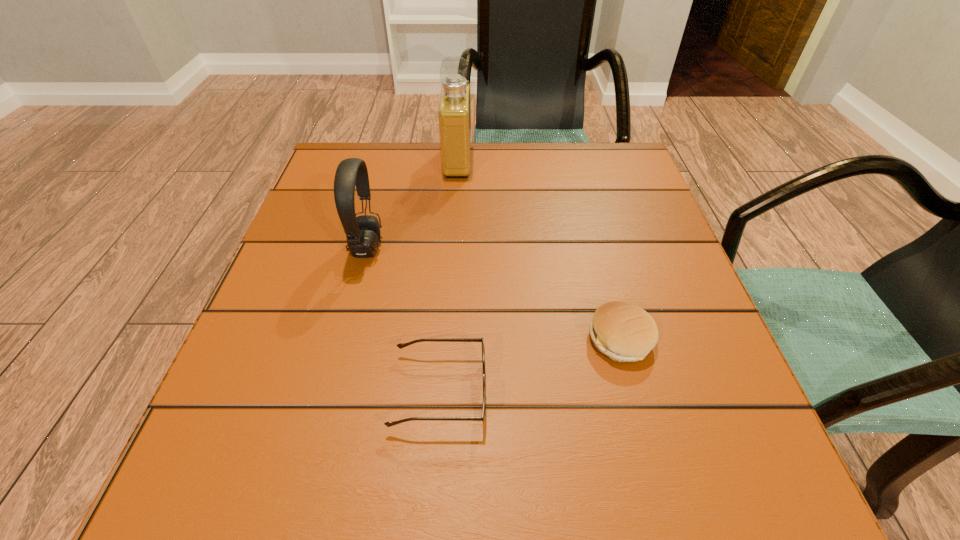
Where is `vacant area that lies between the sunglasses and the patty`? vacant area that lies between the sunglasses and the patty is located at coordinates (530, 365).

Locate an element on the screen. The width and height of the screenshot is (960, 540). vacant area that lies between the second shortest object and the second tallest object is located at coordinates (493, 293).

You are a GUI agent. You are given a task and a screenshot of the screen. Output one action in this format:
    pyautogui.click(x=<x>, y=<y>)
    Task: Click on the vacant area that lies between the patty and the sunglasses
    This screenshot has width=960, height=540.
    Given the screenshot: What is the action you would take?
    pyautogui.click(x=530, y=365)

The height and width of the screenshot is (540, 960). In order to click on unoccupied area between the second shortest object and the shortest object in this screenshot , I will do coord(530,365).

Identify the location of free point between the sunglasses and the leftmost object. This screenshot has width=960, height=540. (403, 319).

Where is `vacant area between the rightmost object and the perfume`? This screenshot has width=960, height=540. vacant area between the rightmost object and the perfume is located at coordinates (539, 250).

Where is `free spot between the patty and the sunglasses`? The height and width of the screenshot is (540, 960). free spot between the patty and the sunglasses is located at coordinates (530, 365).

You are a GUI agent. You are given a task and a screenshot of the screen. Output one action in this format:
    pyautogui.click(x=<x>, y=<y>)
    Task: Click on the vacant space that's between the rightmost object and the tallest object
    
    Given the screenshot: What is the action you would take?
    pyautogui.click(x=539, y=250)

What are the coordinates of `free point between the headset and the tallest object` in the screenshot? It's located at (412, 204).

Identify the location of free space that is in between the rightmost object and the third shortest object. Image resolution: width=960 pixels, height=540 pixels. (493, 293).